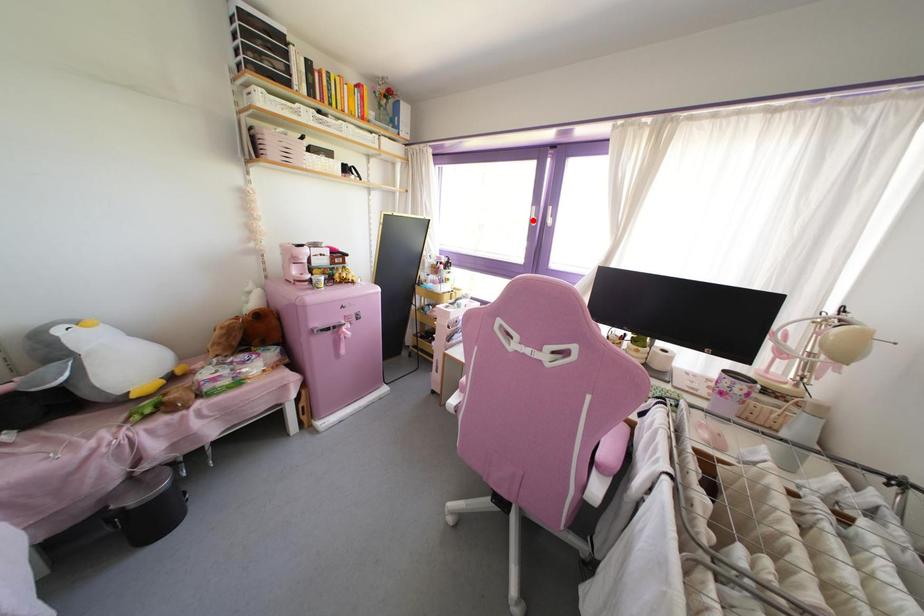
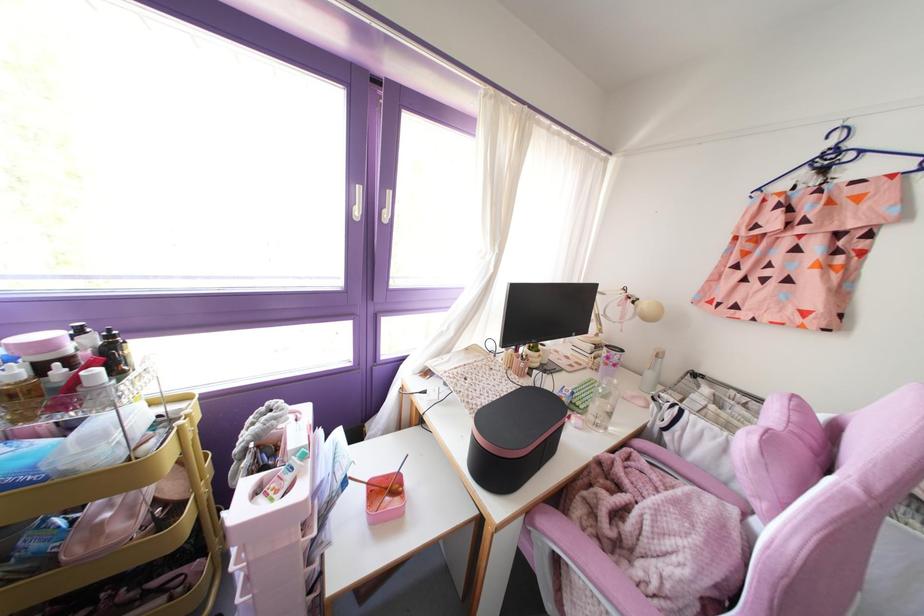
Find the pixel in the second image that matches the highlighted location in the first image.

(357, 212)